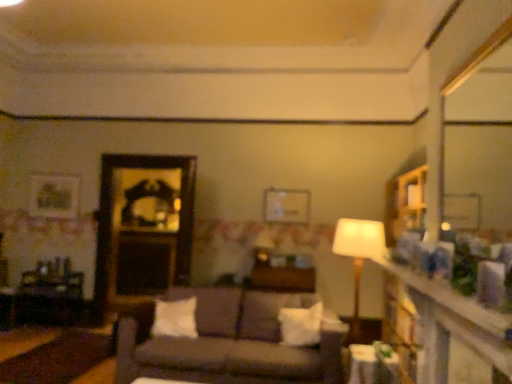
Question: Is white soft pillow at center, placed as the 1th pillow when sorted from left to right, located within white soft pillow at center, which is counted as the first pillow, starting from the right?

Choices:
 (A) yes
 (B) no

Answer: (B)

Question: From a real-world perspective, is white soft pillow at center, arranged as the 2th pillow when viewed from the left, on white soft pillow at center, which ranks as the 2th pillow in right-to-left order?

Choices:
 (A) no
 (B) yes

Answer: (A)

Question: Is white soft pillow at center, which is counted as the first pillow, starting from the right, facing away from white soft pillow at center, which ranks as the 2th pillow in right-to-left order?

Choices:
 (A) no
 (B) yes

Answer: (A)

Question: Is white soft pillow at center, which is counted as the first pillow, starting from the right, smaller than white soft pillow at center, which ranks as the 2th pillow in right-to-left order?

Choices:
 (A) no
 (B) yes

Answer: (A)

Question: Is white soft pillow at center, arranged as the 2th pillow when viewed from the left, aimed at white soft pillow at center, which ranks as the 2th pillow in right-to-left order?

Choices:
 (A) no
 (B) yes

Answer: (A)

Question: Is white soft pillow at center, which is counted as the first pillow, starting from the right, positioned beyond the bounds of white soft pillow at center, which ranks as the 2th pillow in right-to-left order?

Choices:
 (A) no
 (B) yes

Answer: (B)

Question: Is white soft pillow at center, which ranks as the 2th pillow in right-to-left order, at the left side of white glossy table at lower right, placed as the 1th table when sorted from front to back?

Choices:
 (A) yes
 (B) no

Answer: (A)

Question: From the image's perspective, is white soft pillow at center, placed as the 1th pillow when sorted from left to right, above white glossy table at lower right, which is the 1th table from right to left?

Choices:
 (A) no
 (B) yes

Answer: (B)

Question: Does white soft pillow at center, which ranks as the 2th pillow in right-to-left order, have a greater width compared to white glossy table at lower right, placed as the 1th table when sorted from front to back?

Choices:
 (A) yes
 (B) no

Answer: (B)

Question: Does white soft pillow at center, placed as the 1th pillow when sorted from left to right, have a larger size compared to white glossy table at lower right, placed as the 1th table when sorted from front to back?

Choices:
 (A) yes
 (B) no

Answer: (B)

Question: Does white soft pillow at center, which ranks as the 2th pillow in right-to-left order, lie behind white glossy table at lower right, which appears as the third table when viewed from the back?

Choices:
 (A) yes
 (B) no

Answer: (A)

Question: From the image's perspective, is white soft pillow at center, placed as the 1th pillow when sorted from left to right, below white glossy table at lower right, placed as the 1th table when sorted from front to back?

Choices:
 (A) yes
 (B) no

Answer: (B)

Question: From the image's perspective, does wooden table at center, arranged as the second table when viewed from the front, appear higher than smooth wooden mirror at upper right, positioned as the 1th mirror in right-to-left order?

Choices:
 (A) yes
 (B) no

Answer: (B)